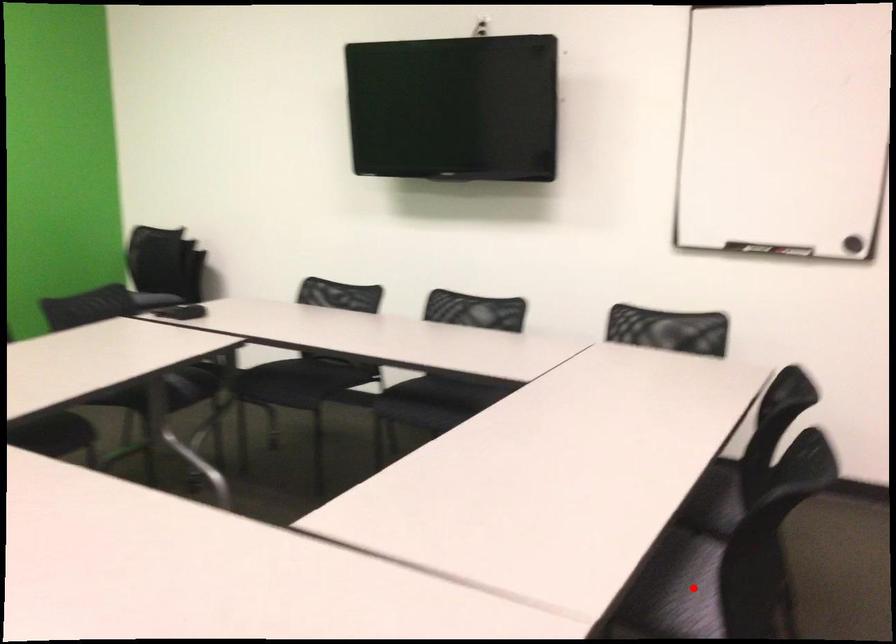
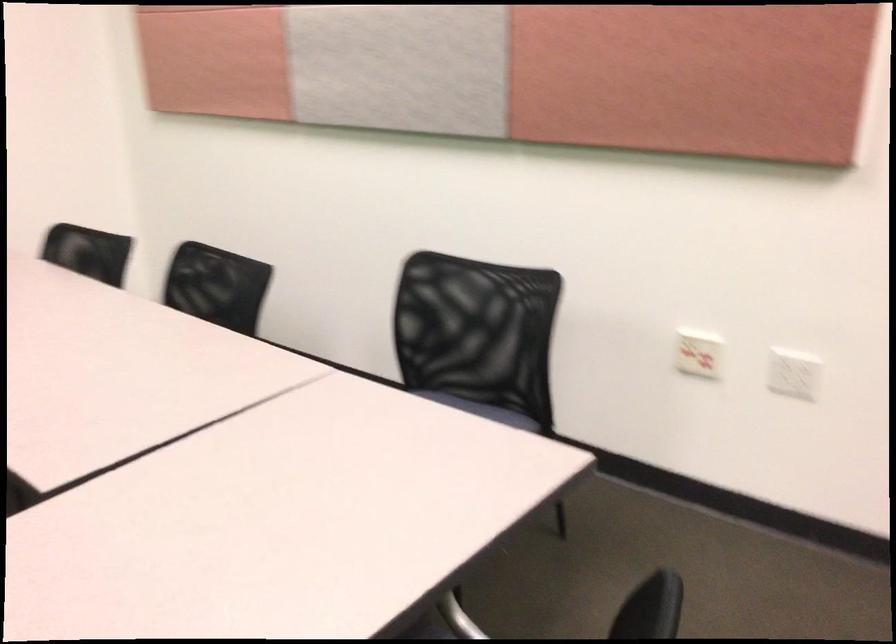
Question: I am providing you with two images of the same scene from different viewpoints. A red point is marked on the first image. At the location where the point appears in image 1, is it still visible in image 2?

Choices:
 (A) Yes
 (B) No

Answer: (B)